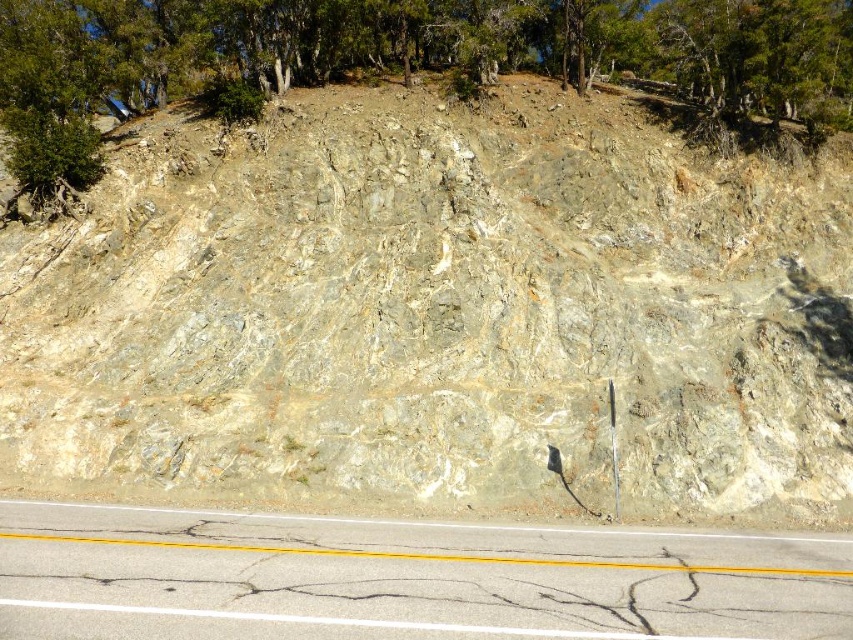
Question: Which point is closer to the camera?

Choices:
 (A) (x=515, y=612)
 (B) (x=78, y=145)
 (C) (x=471, y=186)

Answer: (A)

Question: Where is asphalt road at lower center located in relation to green leafy tree at upper center in the image?

Choices:
 (A) right
 (B) left

Answer: (B)

Question: Can you confirm if asphalt road at lower center is bigger than green leafy tree at upper center?

Choices:
 (A) no
 (B) yes

Answer: (A)

Question: Among these points, which one is farthest from the camera?

Choices:
 (A) (56, 154)
 (B) (3, 598)

Answer: (A)

Question: Is gray rock at center wider than asphalt road at lower center?

Choices:
 (A) yes
 (B) no

Answer: (A)

Question: Which object appears farthest from the camera in this image?

Choices:
 (A) gray rock at center
 (B) green leafy tree at upper center
 (C) asphalt road at lower center

Answer: (B)